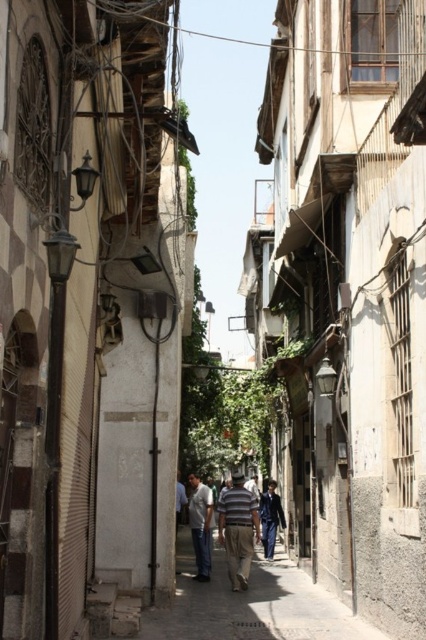
Can you confirm if striped cotton shirt at center is positioned above light blue jeans at center?

→ Incorrect, striped cotton shirt at center is not positioned above light blue jeans at center.

Between point (238, 579) and point (207, 579), which one is positioned behind?

Point (207, 579)

Image resolution: width=426 pixels, height=640 pixels. I want to click on striped cotton shirt at center, so click(x=238, y=531).